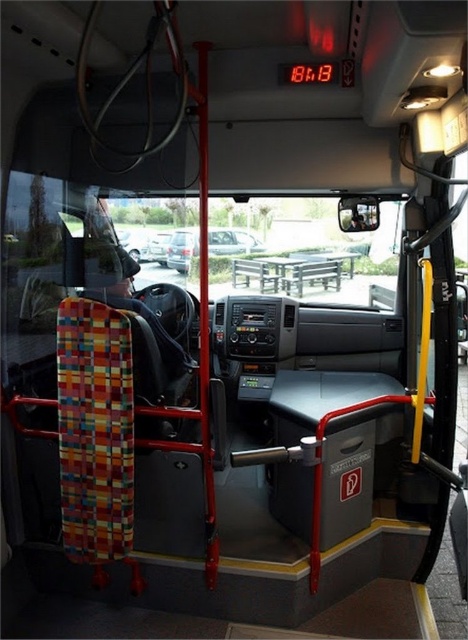
You are a bus driver who needs to park the bus in a narrow alley. The alley is only wide enough for a standard sedan. There is a metallic silver car at center and a silver metallic sedan at center in the image. Which vehicle should you choose to park in the alley?

The silver metallic sedan at center is narrower than the metallic silver car at center, so you should choose the silver metallic sedan at center to park in the alley since it is narrower and fits the alley width.

You are a passenger on the bus and want to know which vehicle is closer to you between the metallic silver car at center and the silver metallic sedan at center. Which one is closer?

The metallic silver car at center is closer to the viewer than the silver metallic sedan at center.

In the scene shown: You are a passenger on the bus and want to reach the control panel below the digital clock. You notice two points marked on the dashboard. Which of the two points, point (190, 236) or point (161, 248), is closer to you as you sit in your seat?

Point (161, 248) is closer to you because it is less further to the camera compared to point (190, 236), which is stated to be further away.